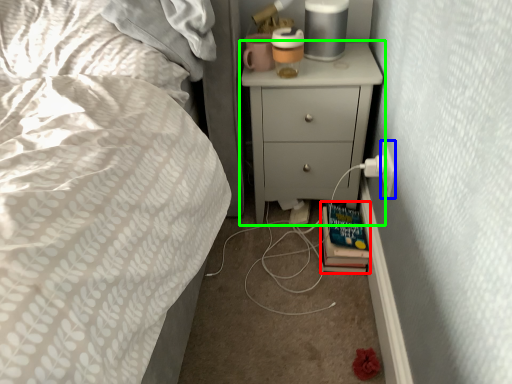
Question: Estimate the real-world distances between objects in this image. Which object is farther from book (highlighted by a red box), electric outlet (highlighted by a blue box) or chest of drawers (highlighted by a green box)?

Choices:
 (A) electric outlet
 (B) chest of drawers

Answer: (B)